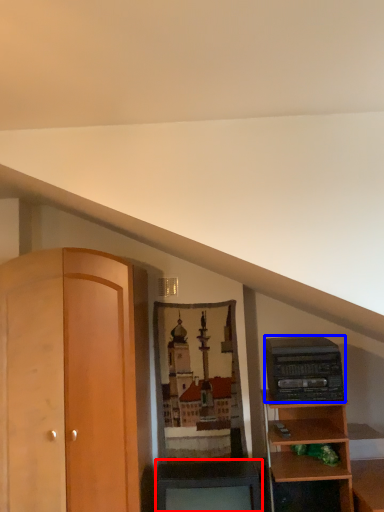
Question: Which point is closer to the camera, cabinetry (highlighted by a red box) or stereo (highlighted by a blue box)?

Choices:
 (A) cabinetry
 (B) stereo

Answer: (A)